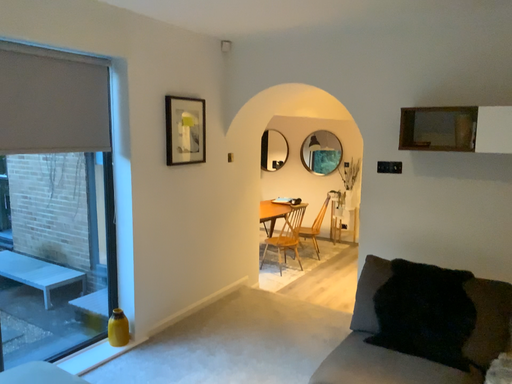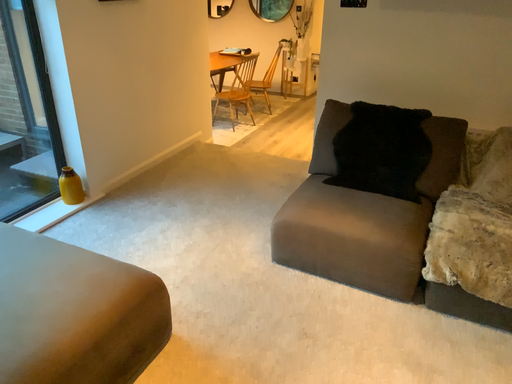
Question: Which way did the camera rotate in the video?

Choices:
 (A) rotated left
 (B) rotated right

Answer: (B)